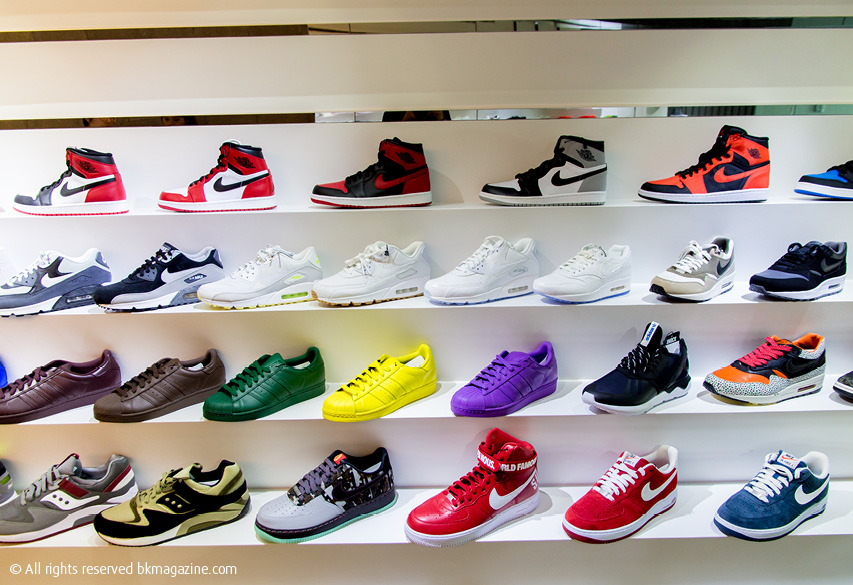
Locate an element on the screen. This screenshot has width=853, height=585. shoes on the second lowest shelf is located at coordinates (51, 388), (144, 394), (260, 387), (366, 387), (503, 378), (648, 373), (743, 377), (842, 381).